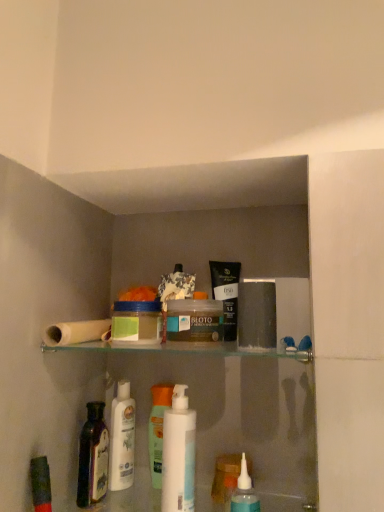
Question: Is point (51, 334) closer or farther from the camera than point (157, 466)?

Choices:
 (A) closer
 (B) farther

Answer: (A)

Question: From the image's perspective, is white matte toilet paper at upper left positioned above or below translucent plastic bottle at center, which appears as the second toiletry when viewed from the left?

Choices:
 (A) above
 (B) below

Answer: (A)

Question: Estimate the real-world distances between objects in this image. Which object is closer to the matte black tube at upper center, placed as the 1th toiletry when sorted from right to left?

Choices:
 (A) translucent plastic jar at center, the 2th mouthwash from the bottom
 (B) translucent plastic container at center, the 1th mouthwash in the top-to-bottom sequence
 (C) white plastic bottle at center, the first toiletry positioned from the left
 (D) white matte toilet paper at upper left
 (E) dark purple glass bottle at lower left

Answer: (A)

Question: Which object is the closest to the white plastic bottle at center, marked as the first mouthwash in a bottom-to-top arrangement?

Choices:
 (A) white matte toilet paper at upper left
 (B) dark purple glass bottle at lower left
 (C) matte black tube at upper center, placed as the 1th toiletry when sorted from right to left
 (D) translucent plastic bottle at center, which appears as the second toiletry when viewed from the left
 (E) translucent plastic jar at center, which is the second mouthwash in top-to-bottom order

Answer: (D)